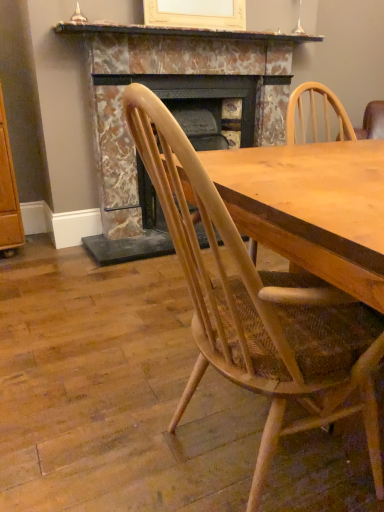
Question: From a real-world perspective, is natural wood chair at center under marble fireplace at center?

Choices:
 (A) yes
 (B) no

Answer: (A)

Question: Can you confirm if natural wood chair at center is shorter than marble fireplace at center?

Choices:
 (A) no
 (B) yes

Answer: (B)

Question: Can you confirm if natural wood chair at center is bigger than marble fireplace at center?

Choices:
 (A) no
 (B) yes

Answer: (A)

Question: Is natural wood chair at center oriented away from marble fireplace at center?

Choices:
 (A) yes
 (B) no

Answer: (B)

Question: Is natural wood chair at center beside marble fireplace at center?

Choices:
 (A) yes
 (B) no

Answer: (B)

Question: Is point (84, 28) positioned closer to the camera than point (231, 61)?

Choices:
 (A) closer
 (B) farther

Answer: (A)

Question: In terms of width, does marble mantel at upper center look wider or thinner when compared to marble fireplace at center?

Choices:
 (A) thin
 (B) wide

Answer: (A)

Question: From a real-world perspective, is marble mantel at upper center positioned above or below marble fireplace at center?

Choices:
 (A) below
 (B) above

Answer: (B)

Question: From the image's perspective, is marble mantel at upper center located above or below marble fireplace at center?

Choices:
 (A) below
 (B) above

Answer: (B)

Question: Considering the positions of natural wood chair at center and marble fireplace at center in the image, is natural wood chair at center taller or shorter than marble fireplace at center?

Choices:
 (A) short
 (B) tall

Answer: (A)

Question: Is natural wood chair at center bigger or smaller than marble fireplace at center?

Choices:
 (A) big
 (B) small

Answer: (B)

Question: From a real-world perspective, relative to marble fireplace at center, is natural wood chair at center vertically above or below?

Choices:
 (A) below
 (B) above

Answer: (A)

Question: Is point (201, 279) positioned closer to the camera than point (201, 32)?

Choices:
 (A) farther
 (B) closer

Answer: (B)

Question: Considering their positions, is marble fireplace at center located in front of or behind natural wood chair at center?

Choices:
 (A) front
 (B) behind

Answer: (B)

Question: From their relative heights in the image, would you say marble fireplace at center is taller or shorter than natural wood chair at center?

Choices:
 (A) tall
 (B) short

Answer: (A)